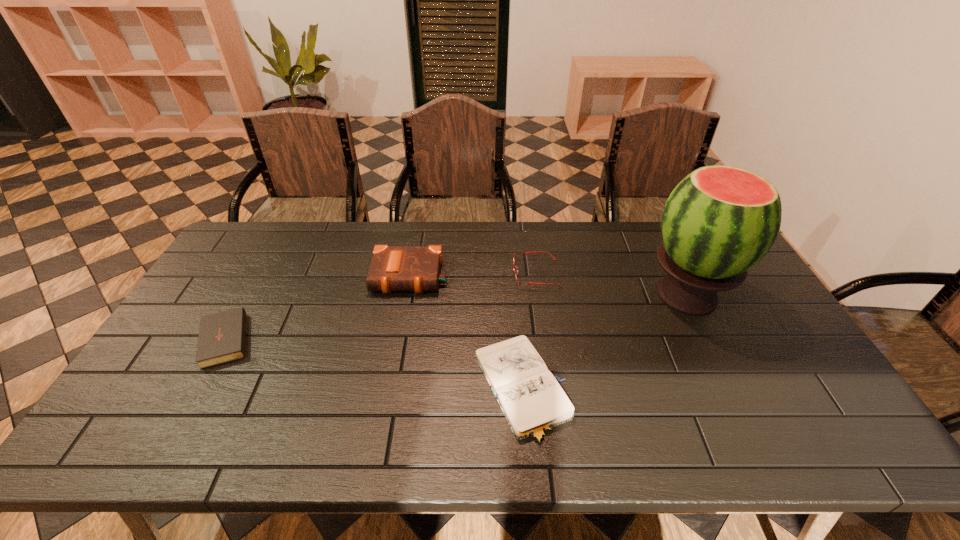
Locate an element on the screen. This screenshot has height=540, width=960. blank area in the image that satisfies the following two spatial constraints: 1. on the spine side of the watermelon; 2. on the left side of the fourth object from right to left is located at coordinates (407, 295).

Image resolution: width=960 pixels, height=540 pixels. Find the location of `vacant point that satisfies the following two spatial constraints: 1. on the lenses of the spectacles; 2. on the spine side of the taller Bible`. vacant point that satisfies the following two spatial constraints: 1. on the lenses of the spectacles; 2. on the spine side of the taller Bible is located at coordinates (537, 276).

Where is `vacant position in the image that satisfies the following two spatial constraints: 1. on the spine side of the taller Bible; 2. on the left side of the notebook`? Image resolution: width=960 pixels, height=540 pixels. vacant position in the image that satisfies the following two spatial constraints: 1. on the spine side of the taller Bible; 2. on the left side of the notebook is located at coordinates (391, 389).